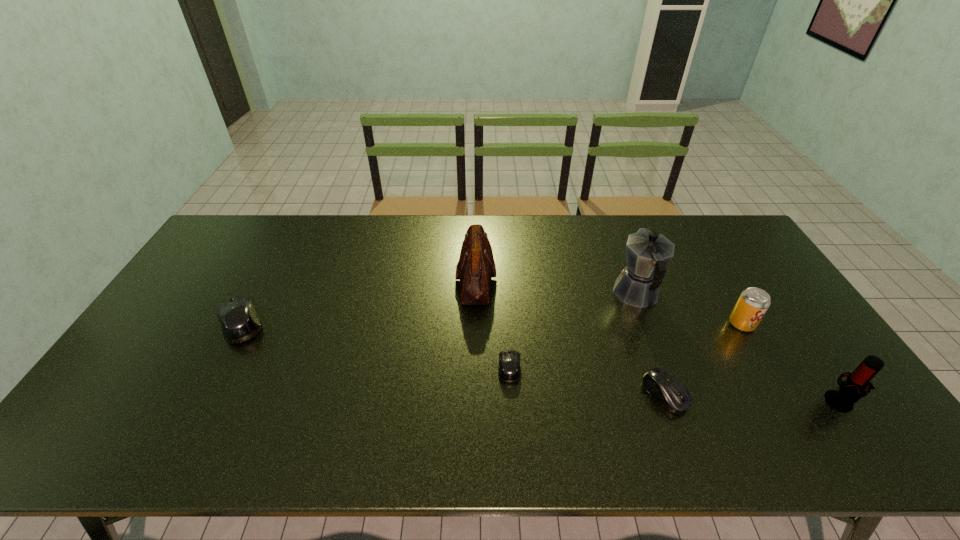
In the image, there is a desktop. In order to click on vacant region at the far left corner in this screenshot , I will do `click(258, 229)`.

At what (x,y) coordinates should I click in order to perform the action: click on vacant space at the near left corner. Please return your answer as a coordinate pair (x, y). Looking at the image, I should click on (134, 393).

In the image, there is a desktop. Where is `blank space at the far right corner`? The image size is (960, 540). blank space at the far right corner is located at coordinates (732, 255).

Where is `free space that is in between the second tallest mouse and the coffeepot`? Image resolution: width=960 pixels, height=540 pixels. free space that is in between the second tallest mouse and the coffeepot is located at coordinates 651,344.

I want to click on empty space that is in between the sixth shortest object and the leftmost mouse, so 358,301.

Identify the location of free space that is in between the microphone and the coffeepot. Image resolution: width=960 pixels, height=540 pixels. (739, 348).

The width and height of the screenshot is (960, 540). Find the location of `free space between the sixth object from left to right and the coffeepot`. free space between the sixth object from left to right and the coffeepot is located at coordinates pos(689,309).

You are a GUI agent. You are given a task and a screenshot of the screen. Output one action in this format:
    pyautogui.click(x=<x>, y=<y>)
    Task: Click on the vacant space that is in between the leftmost object and the shortest mouse
    Image resolution: width=960 pixels, height=540 pixels.
    Given the screenshot: What is the action you would take?
    pyautogui.click(x=375, y=346)

The width and height of the screenshot is (960, 540). I want to click on free space between the coffeepot and the fourth tallest object, so click(689, 309).

The image size is (960, 540). What are the coordinates of `vacant space in between the pop (soda) and the second shortest mouse` in the screenshot? It's located at (704, 359).